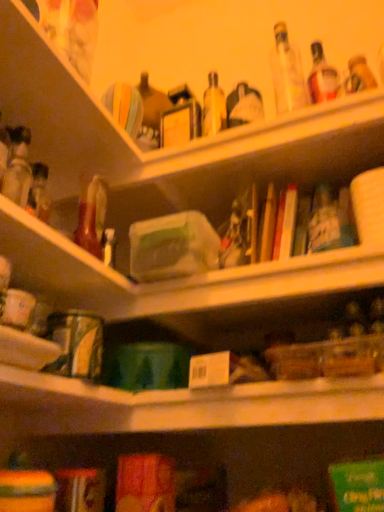
Question: Is translucent glass bottle at left at the right side of matte plastic bag at upper left?

Choices:
 (A) yes
 (B) no

Answer: (B)

Question: Considering the relative sizes of translucent glass bottle at left and matte plastic bag at upper left in the image provided, is translucent glass bottle at left taller than matte plastic bag at upper left?

Choices:
 (A) yes
 (B) no

Answer: (B)

Question: Is translucent glass bottle at left to the left of matte plastic bag at upper left from the viewer's perspective?

Choices:
 (A) no
 (B) yes

Answer: (B)

Question: Is translucent glass bottle at left oriented away from matte plastic bag at upper left?

Choices:
 (A) no
 (B) yes

Answer: (A)

Question: Is translucent glass bottle at left positioned far away from matte plastic bag at upper left?

Choices:
 (A) no
 (B) yes

Answer: (A)

Question: Could you tell me if translucent glass bottle at left is turned towards matte plastic bag at upper left?

Choices:
 (A) yes
 (B) no

Answer: (B)

Question: Is matte plastic bag at upper left behind translucent glass bottle at left?

Choices:
 (A) no
 (B) yes

Answer: (B)

Question: Can you confirm if matte plastic bag at upper left is taller than translucent glass bottle at left?

Choices:
 (A) yes
 (B) no

Answer: (A)

Question: Is matte plastic bag at upper left surrounding translucent glass bottle at left?

Choices:
 (A) yes
 (B) no

Answer: (B)

Question: Is matte plastic bag at upper left positioned in front of translucent glass bottle at left?

Choices:
 (A) yes
 (B) no

Answer: (B)

Question: Does matte plastic bag at upper left have a larger size compared to translucent glass bottle at left?

Choices:
 (A) yes
 (B) no

Answer: (A)

Question: From the image's perspective, is matte plastic bag at upper left below translucent glass bottle at left?

Choices:
 (A) no
 (B) yes

Answer: (A)

Question: Considering the positions of matte plastic bag at upper left and translucent glass bottle at left in the image, is matte plastic bag at upper left wider or thinner than translucent glass bottle at left?

Choices:
 (A) wide
 (B) thin

Answer: (A)